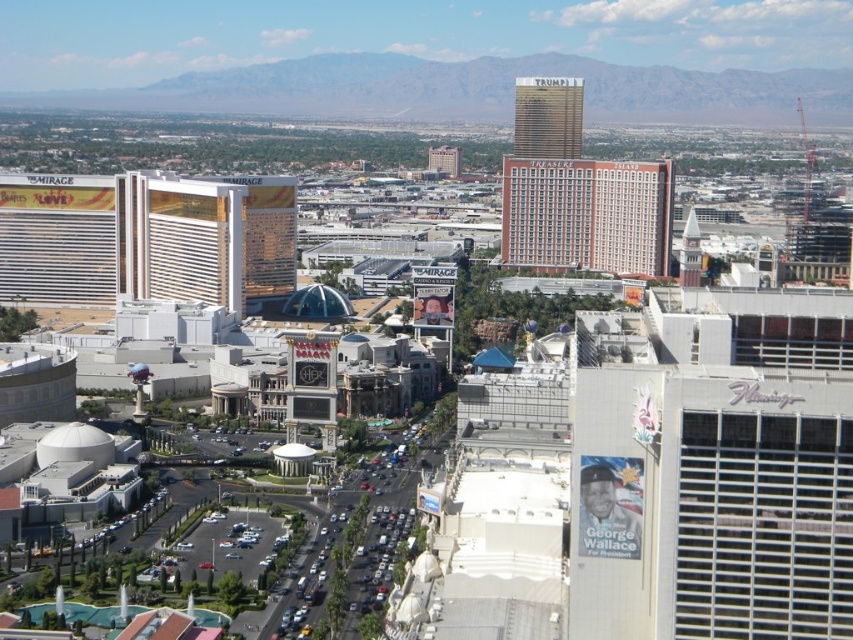
Does white metal flamingo at upper center have a greater height compared to gold reflective hotel at left?

No, white metal flamingo at upper center is not taller than gold reflective hotel at left.

Is white metal flamingo at upper center thinner than gold reflective hotel at left?

Correct, white metal flamingo at upper center's width is less than gold reflective hotel at left's.

Who is more forward, (799, 301) or (225, 221)?

Point (799, 301) is more forward.

The image size is (853, 640). Identify the location of white metal flamingo at upper center. (715, 468).

Looking at this image, does gold reflective hotel at left lie behind beige brick building at center?

No, gold reflective hotel at left is closer to the viewer.

I want to click on gold reflective hotel at left, so point(146,237).

Does white metal flamingo at upper center have a greater height compared to beige brick building at center?

No, white metal flamingo at upper center is not taller than beige brick building at center.

This screenshot has height=640, width=853. In order to click on white metal flamingo at upper center in this screenshot , I will do `click(715, 468)`.

Locate an element on the screen. Image resolution: width=853 pixels, height=640 pixels. white metal flamingo at upper center is located at coordinates (715, 468).